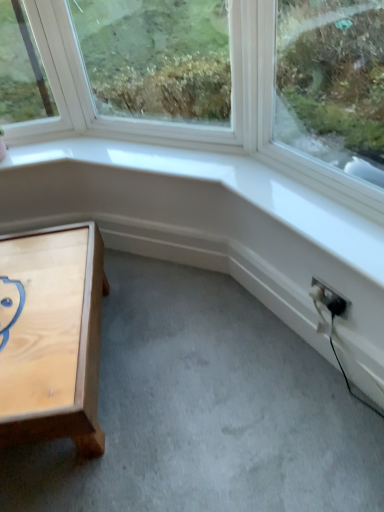
Question: Does light wood table at lower left appear on the left side of black plastic electric outlet at lower right?

Choices:
 (A) yes
 (B) no

Answer: (A)

Question: From the image's perspective, is light wood table at lower left above black plastic electric outlet at lower right?

Choices:
 (A) no
 (B) yes

Answer: (A)

Question: Considering the relative positions of light wood table at lower left and black plastic electric outlet at lower right in the image provided, is light wood table at lower left behind black plastic electric outlet at lower right?

Choices:
 (A) no
 (B) yes

Answer: (A)

Question: Can we say light wood table at lower left lies outside black plastic electric outlet at lower right?

Choices:
 (A) yes
 (B) no

Answer: (A)

Question: Is light wood table at lower left in front of black plastic electric outlet at lower right?

Choices:
 (A) no
 (B) yes

Answer: (B)

Question: Can you confirm if light wood table at lower left is thinner than black plastic electric outlet at lower right?

Choices:
 (A) no
 (B) yes

Answer: (A)

Question: Is black plastic electric outlet at lower right not within light wood table at lower left?

Choices:
 (A) yes
 (B) no

Answer: (A)

Question: Is black plastic electric outlet at lower right further to the viewer compared to light wood table at lower left?

Choices:
 (A) no
 (B) yes

Answer: (B)

Question: Are black plastic electric outlet at lower right and light wood table at lower left making contact?

Choices:
 (A) yes
 (B) no

Answer: (B)

Question: From a real-world perspective, does black plastic electric outlet at lower right sit lower than light wood table at lower left?

Choices:
 (A) no
 (B) yes

Answer: (A)

Question: From the image's perspective, is black plastic electric outlet at lower right above light wood table at lower left?

Choices:
 (A) no
 (B) yes

Answer: (B)

Question: Can you confirm if black plastic electric outlet at lower right is taller than light wood table at lower left?

Choices:
 (A) no
 (B) yes

Answer: (A)

Question: Would you say light wood table at lower left is to the left or to the right of black plastic electric outlet at lower right in the picture?

Choices:
 (A) left
 (B) right

Answer: (A)